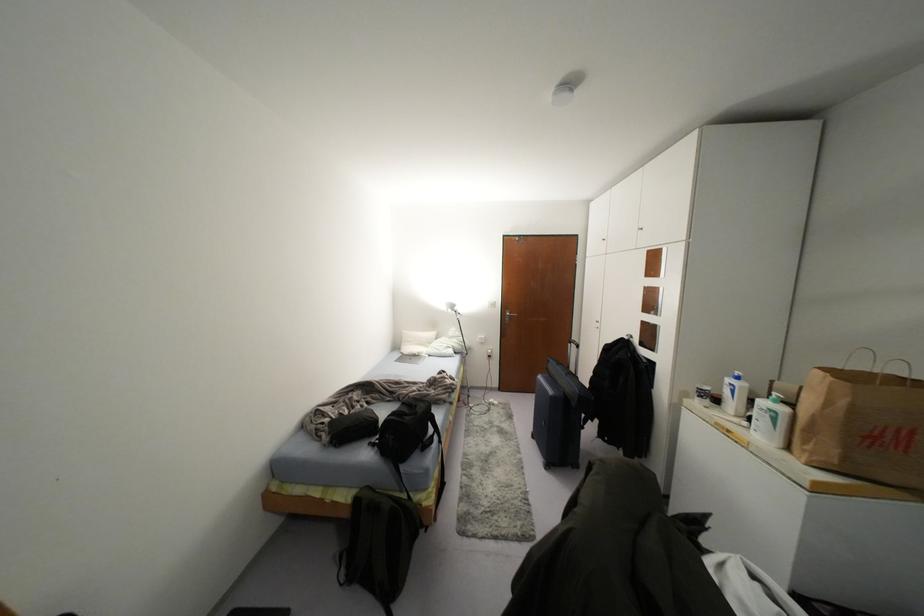
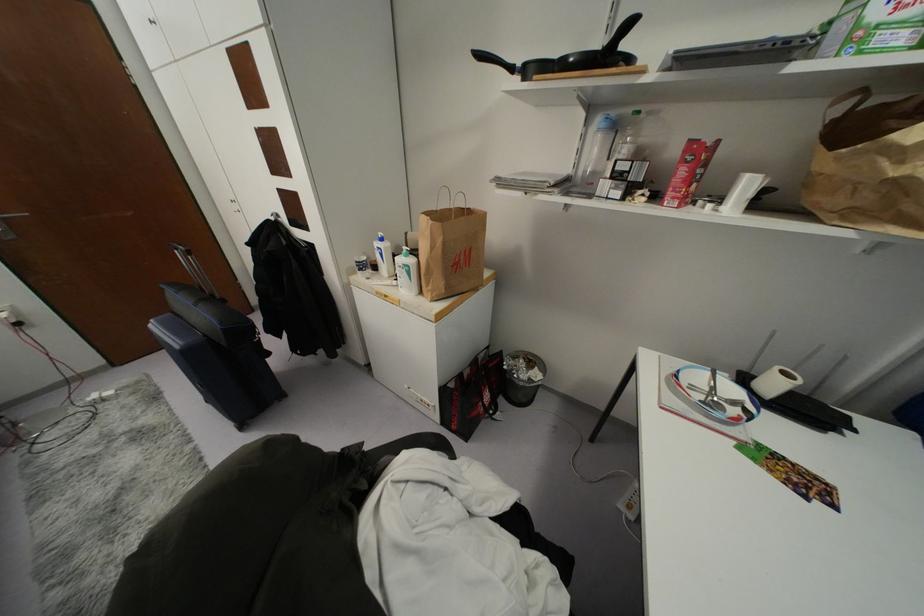
The images are taken continuously from a first-person perspective. In which direction is your viewpoint rotating?

The rotation direction of the camera is right-down.